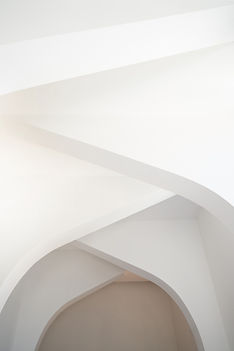
I want to click on edge of third lowest shelf, so click(84, 228).